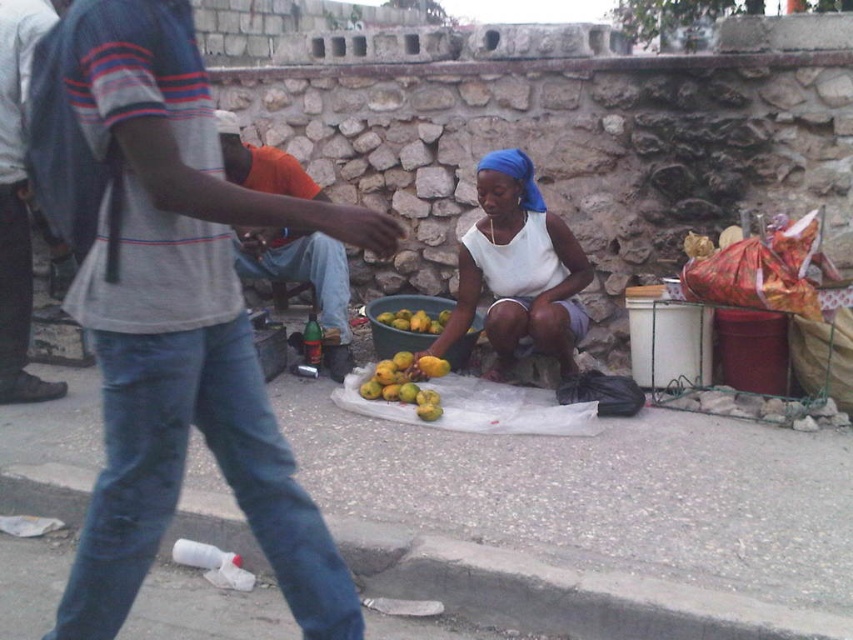
Is smooth concrete pavement at center taller than yellow matte pears at center?

Yes.

Which is below, smooth concrete pavement at center or yellow matte pears at center?

smooth concrete pavement at center is below.

Between point (312, 451) and point (378, 317), which one is positioned in front?

Point (312, 451) is in front.

Identify the location of smooth concrete pavement at center. The height and width of the screenshot is (640, 853). (592, 513).

Does point (113, 595) come in front of point (461, 282)?

Yes, it is.

Is denim jeans at center above white matte tank top at center?

No, denim jeans at center is not above white matte tank top at center.

Between point (142, 513) and point (465, 280), which one is positioned in front?

Positioned in front is point (142, 513).

At what (x,y) coordinates should I click in order to perform the action: click on denim jeans at center. Please return your answer as a coordinate pair (x, y). Looking at the image, I should click on (169, 307).

Can you confirm if smooth concrete pavement at center is positioned below denim jeans at center?

Yes.

Can you confirm if smooth concrete pavement at center is positioned to the left of denim jeans at center?

Incorrect, smooth concrete pavement at center is not on the left side of denim jeans at center.

Between point (444, 518) and point (91, 188), which one is positioned behind?

The point (444, 518) is behind.

This screenshot has width=853, height=640. I want to click on smooth concrete pavement at center, so click(x=592, y=513).